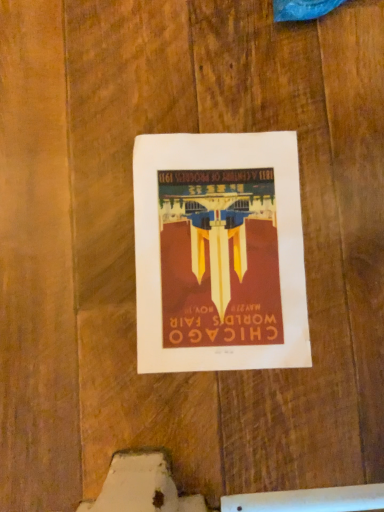
The height and width of the screenshot is (512, 384). What are the coordinates of `blank space above matte paper poster at center (from a real-world perspective)` in the screenshot? It's located at (224, 248).